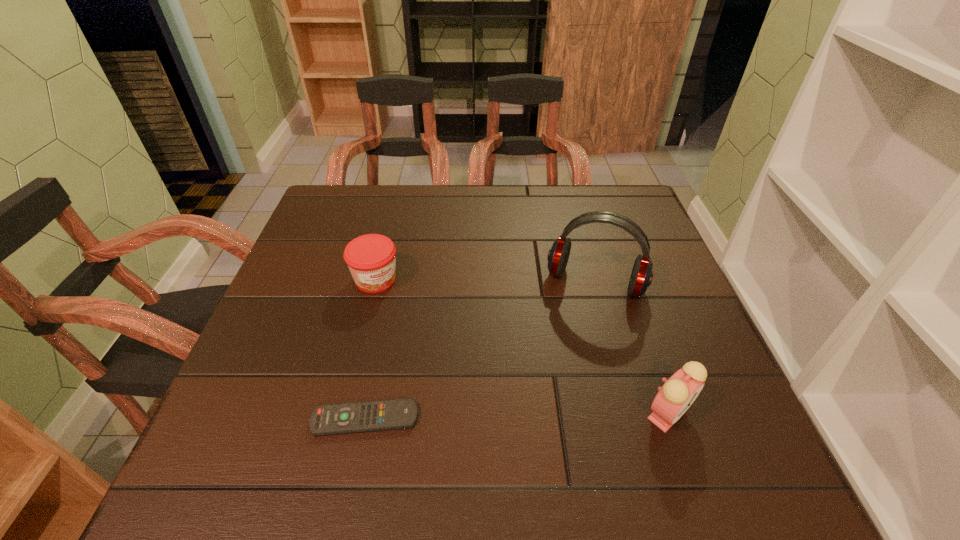
In order to click on vacant spot on the desktop that is between the remote control and the alarm clock and is positioned on the ear cups of the earphone in this screenshot , I will do pyautogui.click(x=554, y=416).

Where is `free space on the desktop that is between the shortest object and the alarm clock and is positioned on the label side of the jam`? free space on the desktop that is between the shortest object and the alarm clock and is positioned on the label side of the jam is located at coordinates (500, 416).